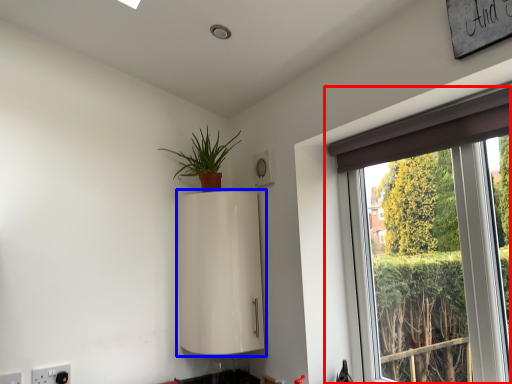
Question: Among these objects, which one is nearest to the camera, window (highlighted by a red box) or appliance (highlighted by a blue box)?

Choices:
 (A) window
 (B) appliance

Answer: (A)